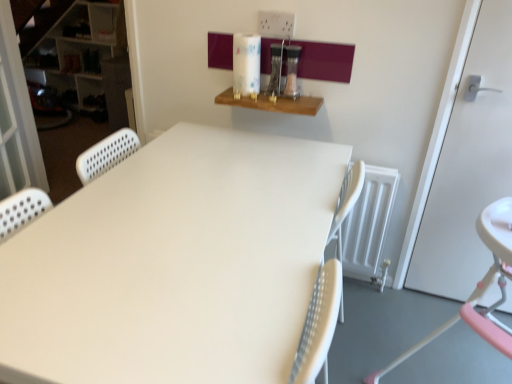
Question: Does white matte door at right have a greater width compared to white matte table at center?

Choices:
 (A) no
 (B) yes

Answer: (A)

Question: Does white matte door at right have a greater height compared to white matte table at center?

Choices:
 (A) no
 (B) yes

Answer: (B)

Question: Would you say white matte door at right contains white matte table at center?

Choices:
 (A) yes
 (B) no

Answer: (B)

Question: From the image's perspective, is white matte door at right beneath white matte table at center?

Choices:
 (A) no
 (B) yes

Answer: (A)

Question: Is white matte door at right at the left side of white matte table at center?

Choices:
 (A) yes
 (B) no

Answer: (B)

Question: Is white matte door at right aimed at white matte table at center?

Choices:
 (A) yes
 (B) no

Answer: (B)

Question: Can you confirm if white plastic bookshelf at left is smaller than white perforated screen door at left?

Choices:
 (A) yes
 (B) no

Answer: (B)

Question: Does white plastic bookshelf at left have a greater height compared to white perforated screen door at left?

Choices:
 (A) yes
 (B) no

Answer: (B)

Question: Could white perforated screen door at left be considered to be inside white plastic bookshelf at left?

Choices:
 (A) no
 (B) yes

Answer: (A)

Question: Does white plastic bookshelf at left have a larger size compared to white perforated screen door at left?

Choices:
 (A) yes
 (B) no

Answer: (A)

Question: Would you say white plastic bookshelf at left is outside white perforated screen door at left?

Choices:
 (A) no
 (B) yes

Answer: (B)

Question: Considering the relative sizes of white plastic bookshelf at left and white perforated screen door at left in the image provided, is white plastic bookshelf at left wider than white perforated screen door at left?

Choices:
 (A) no
 (B) yes

Answer: (B)

Question: Is pink plastic highchair at lower right at the back of white perforated screen door at left?

Choices:
 (A) no
 (B) yes

Answer: (A)